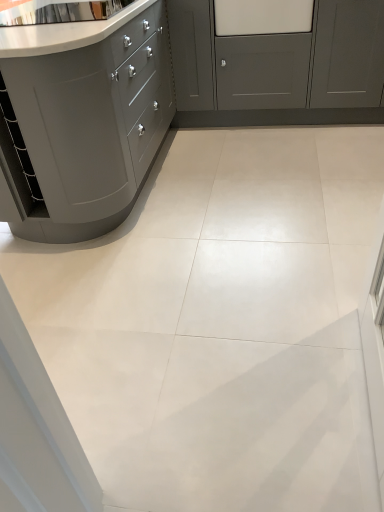
Question: From the image's perspective, is matte gray cabinet at left, placed as the 2th cabinetry when sorted from right to left, on matte gray cabinet at upper right, which ranks as the 1th cabinetry in right-to-left order?

Choices:
 (A) no
 (B) yes

Answer: (A)

Question: Considering the relative positions of matte gray cabinet at left, placed as the 2th cabinetry when sorted from right to left, and matte gray cabinet at upper right, which ranks as the 1th cabinetry in right-to-left order, in the image provided, is matte gray cabinet at left, placed as the 2th cabinetry when sorted from right to left, behind matte gray cabinet at upper right, which ranks as the 1th cabinetry in right-to-left order,?

Choices:
 (A) no
 (B) yes

Answer: (A)

Question: From a real-world perspective, is matte gray cabinet at left, the first cabinetry in the left-to-right sequence, over matte gray cabinet at upper right, which ranks as the 1th cabinetry in right-to-left order?

Choices:
 (A) no
 (B) yes

Answer: (B)

Question: Would you say matte gray cabinet at left, the first cabinetry in the left-to-right sequence, is outside matte gray cabinet at upper right, which ranks as the 1th cabinetry in right-to-left order?

Choices:
 (A) no
 (B) yes

Answer: (B)

Question: Does matte gray cabinet at left, the first cabinetry in the left-to-right sequence, appear on the right side of matte gray cabinet at upper right, which appears as the second cabinetry when viewed from the left?

Choices:
 (A) yes
 (B) no

Answer: (B)

Question: Can you confirm if matte gray cabinet at left, the first cabinetry in the left-to-right sequence, is taller than matte gray cabinet at upper right, which ranks as the 1th cabinetry in right-to-left order?

Choices:
 (A) yes
 (B) no

Answer: (A)

Question: Does matte gray cabinet at upper right, which ranks as the 1th cabinetry in right-to-left order, lie in front of matte gray cabinet at left, the first cabinetry in the left-to-right sequence?

Choices:
 (A) yes
 (B) no

Answer: (B)

Question: Is matte gray cabinet at upper right, which ranks as the 1th cabinetry in right-to-left order, bigger than matte gray cabinet at left, placed as the 2th cabinetry when sorted from right to left?

Choices:
 (A) no
 (B) yes

Answer: (A)

Question: Considering the relative sizes of matte gray cabinet at upper right, which ranks as the 1th cabinetry in right-to-left order, and matte gray cabinet at left, the first cabinetry in the left-to-right sequence, in the image provided, is matte gray cabinet at upper right, which ranks as the 1th cabinetry in right-to-left order, wider than matte gray cabinet at left, the first cabinetry in the left-to-right sequence,?

Choices:
 (A) no
 (B) yes

Answer: (A)

Question: Can you confirm if matte gray cabinet at upper right, which ranks as the 1th cabinetry in right-to-left order, is smaller than matte gray cabinet at left, placed as the 2th cabinetry when sorted from right to left?

Choices:
 (A) yes
 (B) no

Answer: (A)

Question: Is matte gray cabinet at upper right, which ranks as the 1th cabinetry in right-to-left order, at the right side of matte gray cabinet at left, the first cabinetry in the left-to-right sequence?

Choices:
 (A) yes
 (B) no

Answer: (A)

Question: From a real-world perspective, is matte gray cabinet at upper right, which appears as the second cabinetry when viewed from the left, over matte gray cabinet at left, placed as the 2th cabinetry when sorted from right to left?

Choices:
 (A) no
 (B) yes

Answer: (A)

Question: Considering the positions of matte gray cabinet at left, placed as the 2th cabinetry when sorted from right to left, and matte gray cabinet at upper right, which appears as the second cabinetry when viewed from the left, in the image, is matte gray cabinet at left, placed as the 2th cabinetry when sorted from right to left, bigger or smaller than matte gray cabinet at upper right, which appears as the second cabinetry when viewed from the left,?

Choices:
 (A) big
 (B) small

Answer: (A)